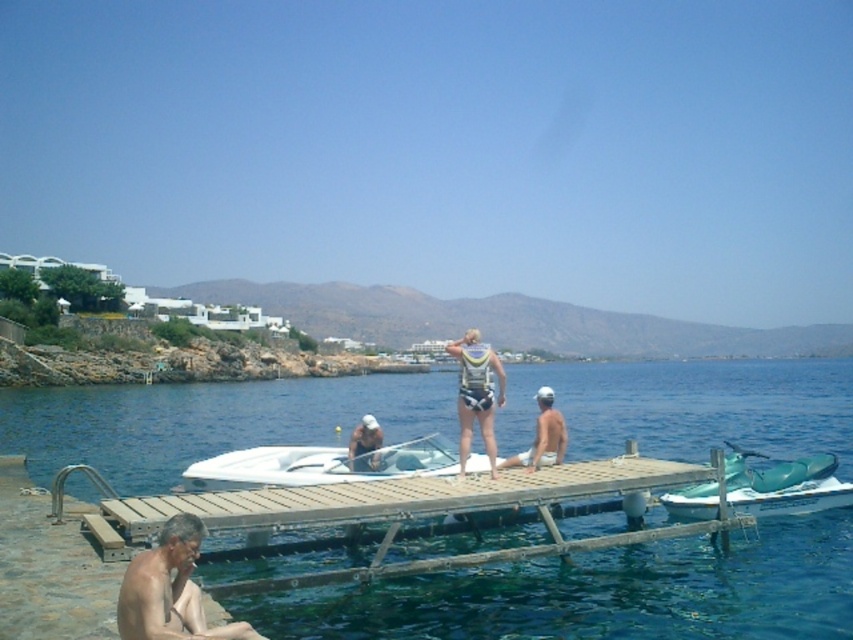
Based on the photo, you are a visitor at the coastal area and want to take a ride on the white glossy boat at center. However, you notice the teal plastic jet ski at lower right is blocking the boat. Can you determine if the boat is accessible for you to board?

The white glossy boat at center is located below the teal plastic jet ski at lower right, so the boat is positioned lower and might be accessible if the jet ski is moved. However, the jet ski is blocking the boat, so you would need to move it first to board the boat.

You are standing on the wooden dock in the coastal scene. You see a point marked at coordinates (476, 394). What object is located at that point?

The point at coordinates (476, 394) corresponds to the white fabric life vest at center.

You are planning to launch a small boat from the dock. The boat requires a minimum width of 3 meters to safely navigate into the water. Given the blue water at center and the teal plastic jet ski at lower right, which one do you think has sufficient width for the boat launch?

The blue water at center has a larger width than the teal plastic jet ski at lower right, so the blue water at center would provide sufficient width for the boat launch.